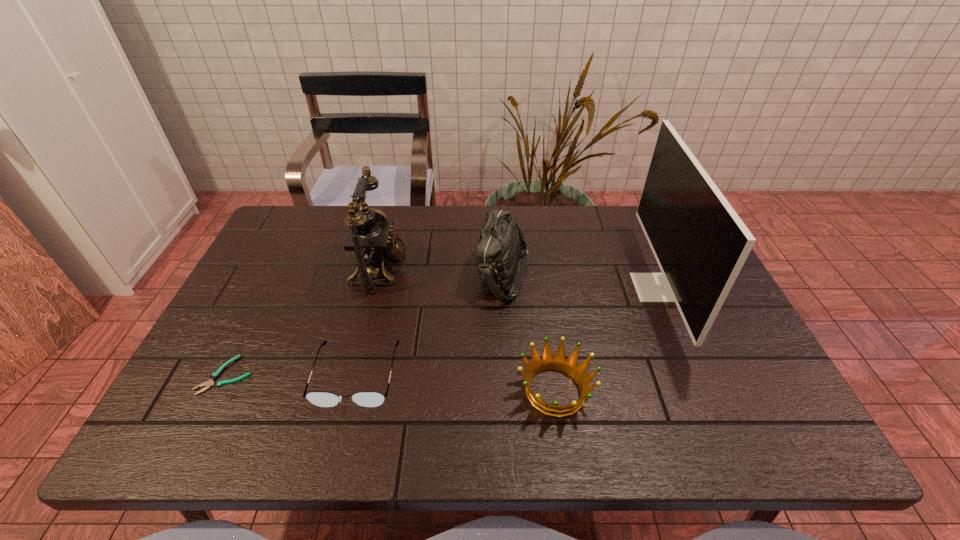
Find the location of a particular element. Image resolution: width=960 pixels, height=540 pixels. the tallest object is located at coordinates (700, 243).

Where is `the rightmost object`? This screenshot has height=540, width=960. the rightmost object is located at coordinates (700, 243).

Identify the location of telephone. The width and height of the screenshot is (960, 540). (370, 240).

At what (x,y) coordinates should I click in order to perform the action: click on shoulder bag. Please return your answer as a coordinate pair (x, y). This screenshot has height=540, width=960. Looking at the image, I should click on click(501, 243).

Locate an element on the screen. This screenshot has width=960, height=540. crown is located at coordinates (548, 362).

Locate an element on the screen. Image resolution: width=960 pixels, height=540 pixels. the fifth tallest object is located at coordinates click(x=322, y=399).

At what (x,y) coordinates should I click in order to perform the action: click on the leftmost object. Please return your answer as a coordinate pair (x, y). The image size is (960, 540). Looking at the image, I should click on (215, 375).

Find the location of `pliers`. pliers is located at coordinates (215, 375).

Locate an element on the screen. This screenshot has width=960, height=540. free space located on the front-facing side of the tallest object is located at coordinates (502, 287).

The width and height of the screenshot is (960, 540). I want to click on vacant region located 0.350m on the front-facing side of the tallest object, so click(x=509, y=287).